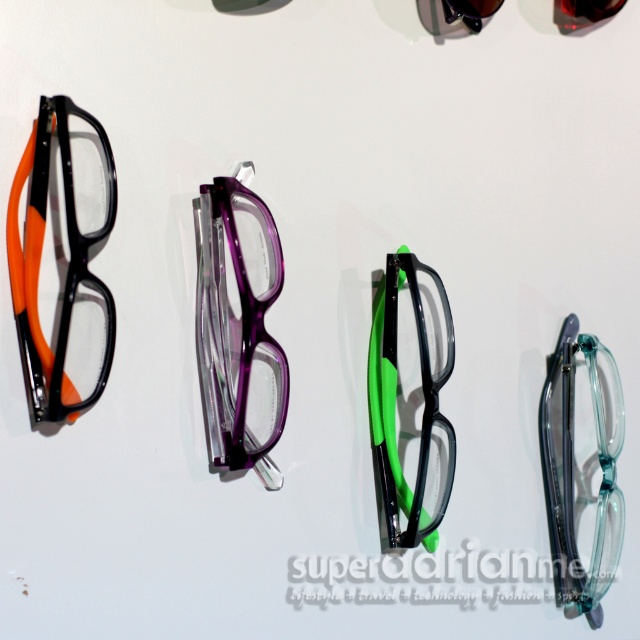
You are a delivery person who needs to place a new pair of glasses between the point at (42, 400) and another point. The new glasses must be placed exactly halfway between them. What are the coordinates of the midpoint where you should place the new glasses?

The midpoint between the two points is calculated by averaging their coordinates. Since the distance between them is 1.27 meters, the midpoint would be at (42, 400) plus half of the distance. However, without knowing the direction or the coordinates of the second point, it is impossible to determine the exact midpoint. Please provide the coordinates of the second point for accurate placement.

You are organizing a display of glasses and need to ensure that the purple translucent glasses at center and transparent plastic glasses at right are arranged properly. Based on their heights, which glasses should be placed on a higher shelf to avoid blocking the view of the shorter ones?

A: The transparent plastic glasses at right are taller than the purple translucent glasses at center, so the purple translucent glasses at center should be placed on a higher shelf to avoid blocking the view of the shorter ones.